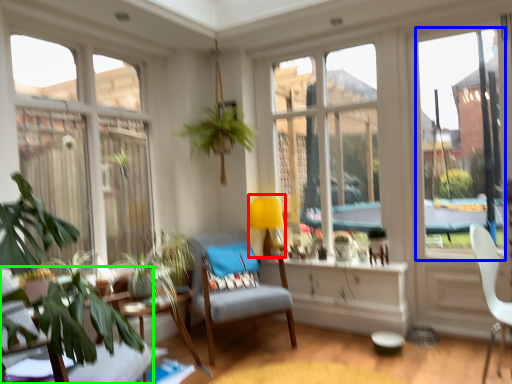
Question: Which object is the farthest from lamp (highlighted by a red box)? Choose among these: window screen (highlighted by a blue box) or chair (highlighted by a green box).

Choices:
 (A) window screen
 (B) chair

Answer: (B)